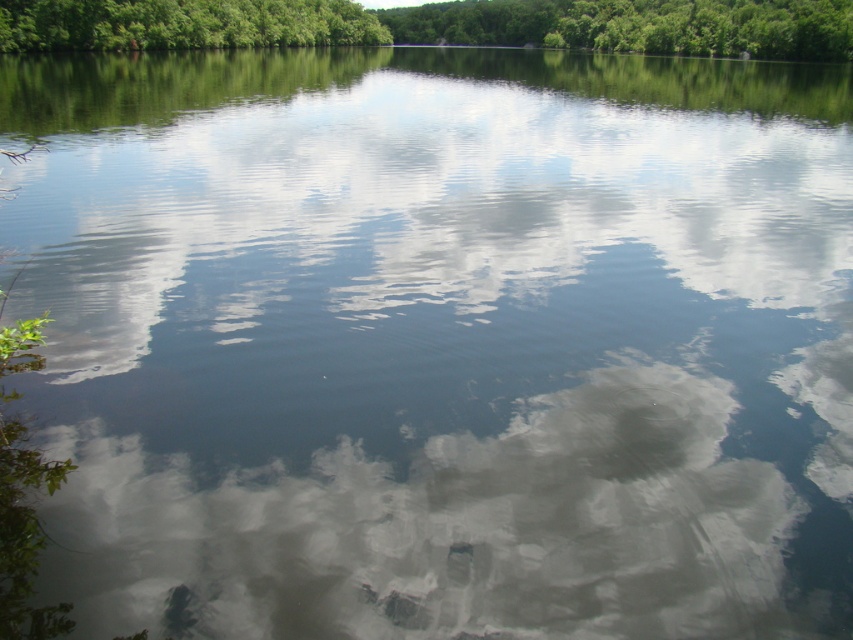
In the scene shown: You are standing on the lakeshore and looking at the green leafy tree at upper center and the green leafy trees at upper center in the background. Which one appears larger in the scene?

The green leafy tree at upper center appears larger than the green leafy trees at upper center because it is closer to the viewer, making it look bigger.

You are standing at the edge of the lake and see two points in the water. The first point is located at coordinate point(212, 595) and the second at point(99, 10). Which point is closer to you?

Point(212, 595) is in front of point(99, 10), so it is closer to you.

You are standing at the edge of the water and looking towards the horizon. There is a green leafy tree at upper center located at point (438, 24). Can you see the green leafy tree at upper center from your current position?

Yes, the green leafy tree at upper center is located at point (438, 24), which is within the visible area of the image. Since the scene describes a tranquil body of water with a dense line of green trees in the background stretching across the horizon, the tree should be visible from your position at the edge of the water.